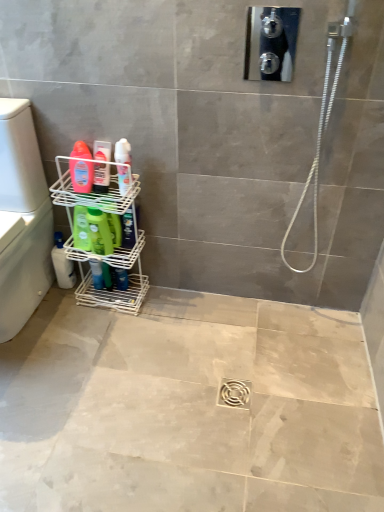
Question: Could white wire shelf at lower left be considered to be inside silver metallic hose at upper right?

Choices:
 (A) yes
 (B) no

Answer: (B)

Question: From the image's perspective, does silver metallic hose at upper right appear lower than white wire shelf at lower left?

Choices:
 (A) no
 (B) yes

Answer: (A)

Question: Can you confirm if silver metallic hose at upper right is positioned to the left of white wire shelf at lower left?

Choices:
 (A) yes
 (B) no

Answer: (B)

Question: Is silver metallic hose at upper right completely or partially outside of white wire shelf at lower left?

Choices:
 (A) no
 (B) yes

Answer: (B)

Question: Can you confirm if silver metallic hose at upper right is thinner than white wire shelf at lower left?

Choices:
 (A) yes
 (B) no

Answer: (A)

Question: Is silver metallic hose at upper right oriented away from white wire shelf at lower left?

Choices:
 (A) yes
 (B) no

Answer: (B)

Question: Is silver metallic hose at upper right in contact with green matte bottle at lower left, arranged as the second cleaning product when viewed from the front?

Choices:
 (A) yes
 (B) no

Answer: (B)

Question: Is silver metallic hose at upper right looking in the opposite direction of green matte bottle at lower left, the third cleaning product viewed from the left?

Choices:
 (A) no
 (B) yes

Answer: (A)

Question: Does silver metallic hose at upper right contain green matte bottle at lower left, arranged as the second cleaning product when viewed from the front?

Choices:
 (A) yes
 (B) no

Answer: (B)

Question: From a real-world perspective, is silver metallic hose at upper right beneath green matte bottle at lower left, which ranks as the 2th cleaning product in back-to-front order?

Choices:
 (A) no
 (B) yes

Answer: (A)

Question: From the image's perspective, is silver metallic hose at upper right on green matte bottle at lower left, the third cleaning product viewed from the left?

Choices:
 (A) no
 (B) yes

Answer: (B)

Question: Is silver metallic hose at upper right outside of green matte bottle at lower left, the 2th cleaning product in the bottom-to-top sequence?

Choices:
 (A) yes
 (B) no

Answer: (A)

Question: Is white plastic washer at left at the left side of matte pink bottle at left, the second cleaning product when ordered from right to left?

Choices:
 (A) yes
 (B) no

Answer: (A)